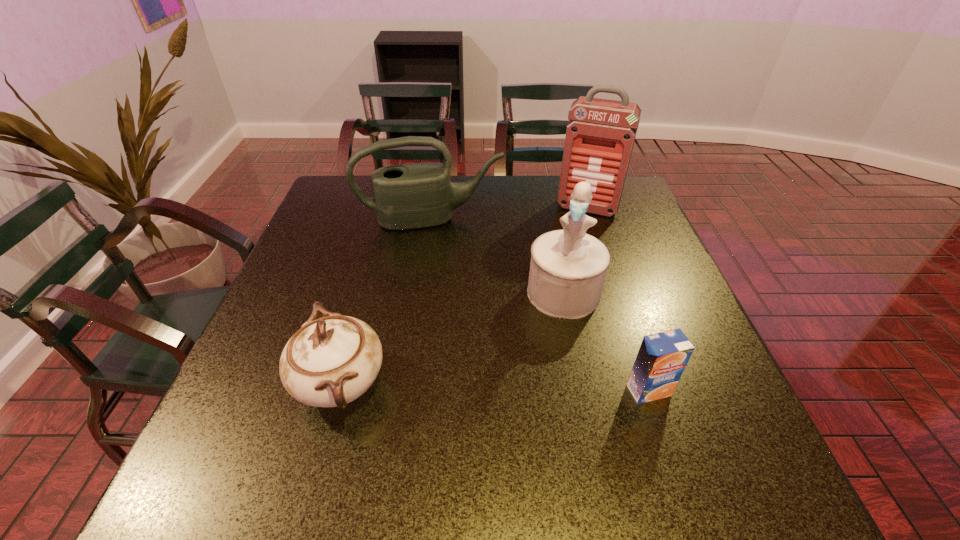
At what (x,y) coordinates should I click in order to perform the action: click on the fourth tallest object. Please return your answer as a coordinate pair (x, y). This screenshot has height=540, width=960. Looking at the image, I should click on (329, 362).

In order to click on the shortest object in this screenshot , I will do `click(662, 357)`.

Find the location of a particular element. The width and height of the screenshot is (960, 540). the third shortest object is located at coordinates (417, 195).

Where is `the tallest object`? The height and width of the screenshot is (540, 960). the tallest object is located at coordinates (600, 135).

You are a GUI agent. You are given a task and a screenshot of the screen. Output one action in this format:
    pyautogui.click(x=<x>, y=<y>)
    Task: Click on the second tallest object
    The width and height of the screenshot is (960, 540).
    Given the screenshot: What is the action you would take?
    pyautogui.click(x=568, y=267)

Find the location of a particular element. The width and height of the screenshot is (960, 540). the third farthest object is located at coordinates (568, 267).

The width and height of the screenshot is (960, 540). In order to click on vacant space situated 0.200m on the back of the fourth tallest object in this screenshot , I will do `click(370, 278)`.

Image resolution: width=960 pixels, height=540 pixels. Find the location of `free point located on the left of the orange_juice`. free point located on the left of the orange_juice is located at coordinates (457, 390).

Locate an element on the screen. This screenshot has width=960, height=540. free spot located on the spout of the watering can is located at coordinates (467, 340).

Identify the location of vacant space situated 0.120m on the spout of the watering can. (449, 258).